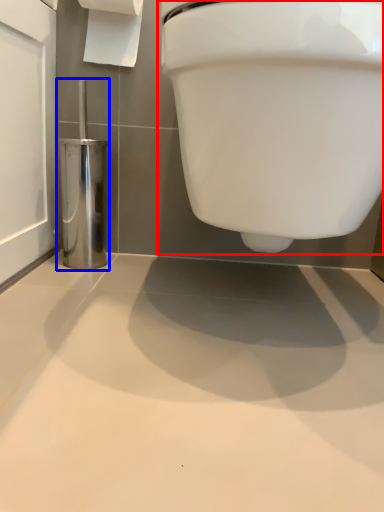
Question: Which of the following is the closest to the observer, toilet (highlighted by a red box) or porcelain (highlighted by a blue box)?

Choices:
 (A) toilet
 (B) porcelain

Answer: (A)